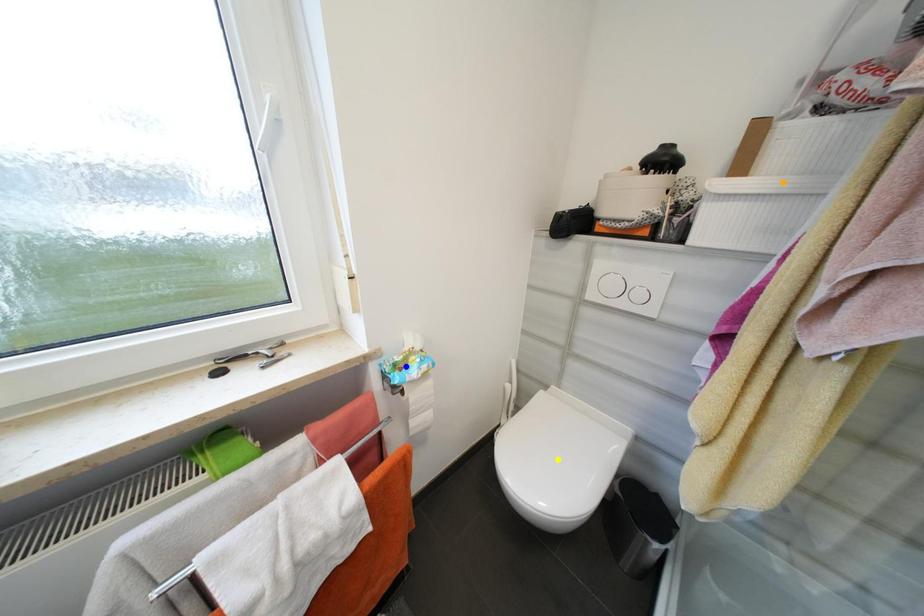
Order these from nearest to farthest:
orange point, yellow point, blue point

yellow point, blue point, orange point